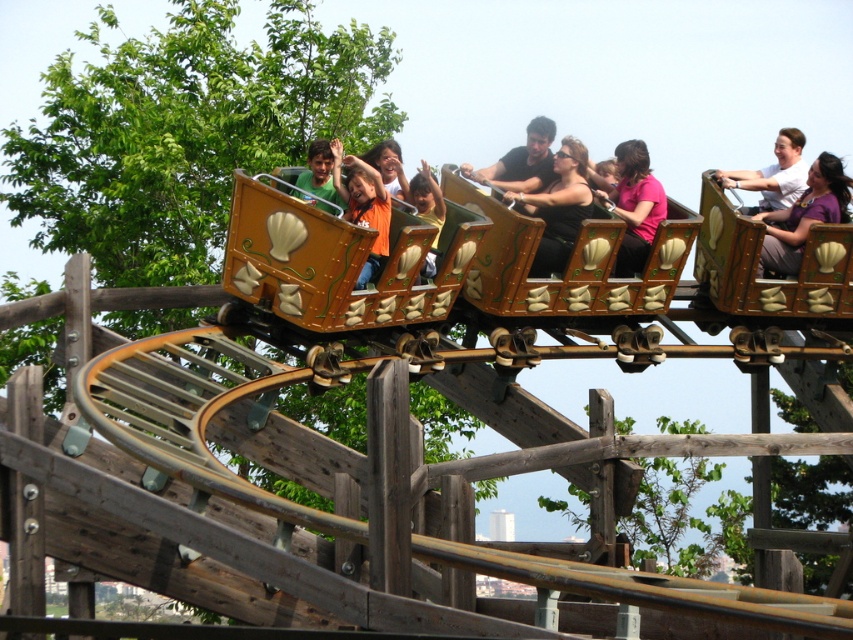
You are standing at the entrance of the amusement park and want to reach the point marked as point (x=625, y=301). If your walking speed is 1.5 meters per second, how many seconds will it take you to reach that point?

The point (x=625, y=301) is 85.75 meters from the viewer. At a walking speed of 1.5 meters per second, it will take 85.75 divided by 1.5, which is approximately 57.17 seconds to reach the point.

You are standing at the base of the roller coaster and see a person wearing the purple matte shirt at upper right. If you want to wave to them, will they likely see your gesture? Please explain your reasoning based on the distance provided.

The purple matte shirt at upper right is 86.29 meters away from the viewer. At this distance, it would be difficult for the person wearing the purple matte shirt at upper right to see a hand gesture from the base of the roller coaster unless they have exceptional vision or a visual aid.